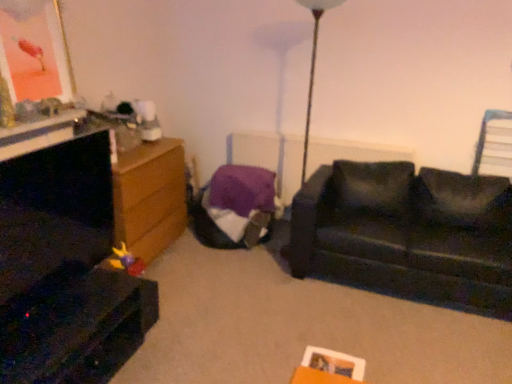
Question: From the image's perspective, is purple fabric radiator at center located above or below dark wood entertainment center at left?

Choices:
 (A) above
 (B) below

Answer: (A)

Question: Would you say purple fabric radiator at center is to the left or to the right of dark wood entertainment center at left in the picture?

Choices:
 (A) left
 (B) right

Answer: (B)

Question: Estimate the real-world distances between objects in this image. Which object is farther from the black leather couch at right?

Choices:
 (A) purple fabric radiator at center
 (B) metallic gold table lamp at center
 (C) metallic blue swivel chair at upper right
 (D) wooden chest of drawers at left
 (E) metallic gold picture frame at upper left

Answer: (E)

Question: Estimate the real-world distances between objects in this image. Which object is closer to the purple fabric radiator at center?

Choices:
 (A) dark wood entertainment center at left
 (B) metallic blue swivel chair at upper right
 (C) metallic gold table lamp at center
 (D) black leather couch at right
 (E) wooden chest of drawers at left

Answer: (C)